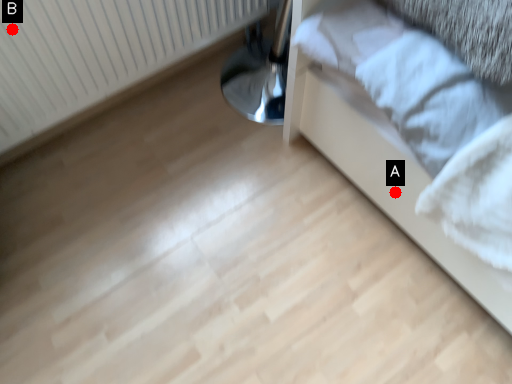
Question: Two points are circled on the image, labeled by A and B beside each circle. Which of the following is the farthest from the observer?

Choices:
 (A) A is further
 (B) B is further

Answer: (A)